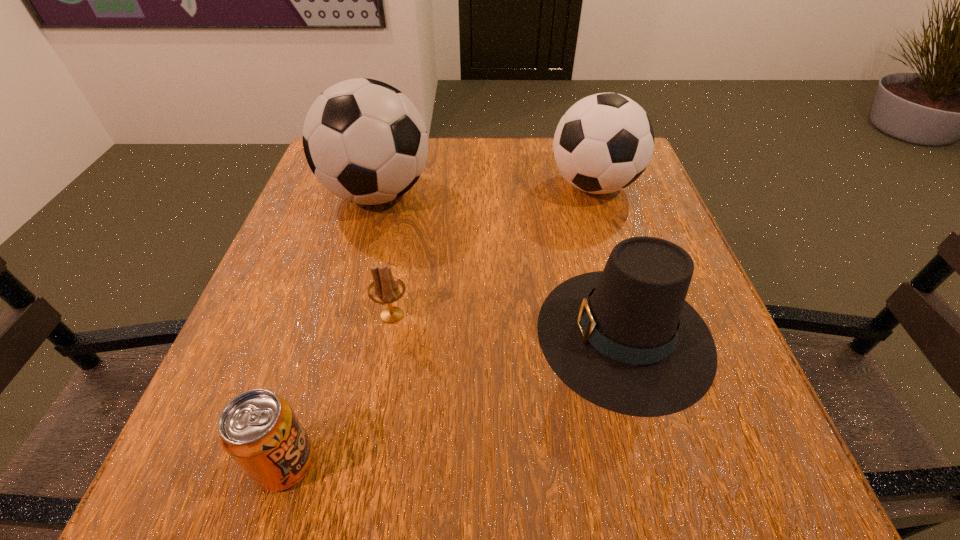
Locate an element on the screen. This screenshot has height=540, width=960. vacant region between the tallest object and the fourth shortest object is located at coordinates (486, 190).

Locate an element on the screen. This screenshot has height=540, width=960. vacant area that lies between the second tallest object and the candle holder is located at coordinates (492, 251).

I want to click on empty space between the soda can and the tallest object, so click(331, 328).

Identify which object is the second closest to the shorter soccer ball. Please provide its 2D coordinates. Your answer should be formatted as a tuple, i.e. [(x, y)], where the tuple contains the x and y coordinates of a point satisfying the conditions above.

[(365, 141)]

Point out which object is positioned as the second nearest to the left soccer ball. Please provide its 2D coordinates. Your answer should be formatted as a tuple, i.e. [(x, y)], where the tuple contains the x and y coordinates of a point satisfying the conditions above.

[(625, 339)]

Identify the location of vacant space that satisfies the following two spatial constraints: 1. on the front side of the tallest object; 2. on the left side of the candle holder. The image size is (960, 540). [344, 315].

The height and width of the screenshot is (540, 960). What are the coordinates of `free spot that satisfies the following two spatial constraints: 1. on the back side of the second tallest object; 2. on the left side of the candle holder` in the screenshot? It's located at (415, 186).

I want to click on vacant space that satisfies the following two spatial constraints: 1. on the back side of the shorter soccer ball; 2. on the right side of the candle holder, so click(x=415, y=186).

The width and height of the screenshot is (960, 540). Identify the location of free space that satisfies the following two spatial constraints: 1. on the front side of the second tallest object; 2. on the front-facing side of the third tallest object. (639, 334).